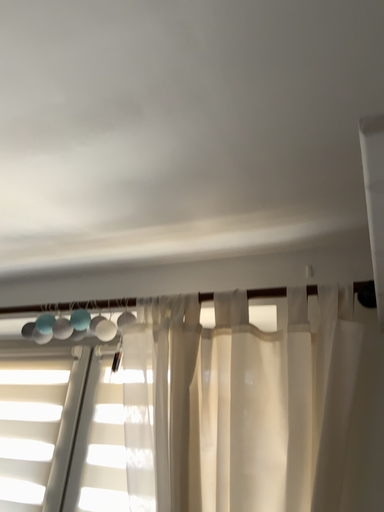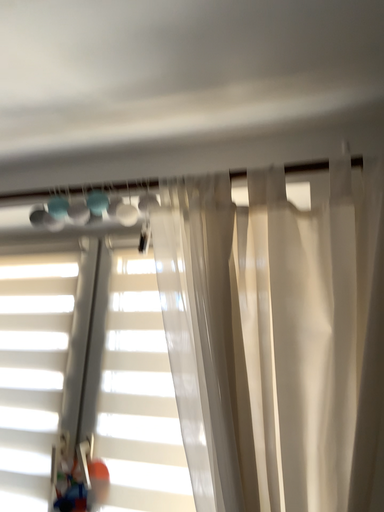
Question: Which way did the camera rotate in the video?

Choices:
 (A) rotated downward
 (B) rotated upward

Answer: (A)